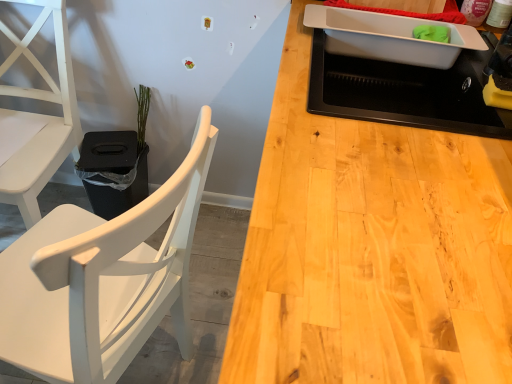
Describe the element at coordinates (142, 115) in the screenshot. I see `green matte plant at upper left` at that location.

At what (x,y) coordinates should I click in order to perform the action: click on black plastic houseplant at left. Please return your answer as a coordinate pair (x, y). The width and height of the screenshot is (512, 384). Looking at the image, I should click on (116, 165).

Locate an element on the screen. white plastic tray at upper right is located at coordinates (389, 37).

The height and width of the screenshot is (384, 512). Find the location of `white matte wood chair at left, the first chair when ordered from right to left`. white matte wood chair at left, the first chair when ordered from right to left is located at coordinates 102,279.

Considering the relative sizes of black matte sink at upper right and white plastic tray at upper right in the image provided, is black matte sink at upper right bigger than white plastic tray at upper right?

Indeed, black matte sink at upper right has a larger size compared to white plastic tray at upper right.

Is black matte sink at upper right facing towards white plastic tray at upper right?

Yes, black matte sink at upper right is turned towards white plastic tray at upper right.

How different are the orientations of black matte sink at upper right and white plastic tray at upper right in degrees?

0.000407 degrees.

You are a GUI agent. You are given a task and a screenshot of the screen. Output one action in this format:
    pyautogui.click(x=<x>, y=<y>)
    Task: Click on the appliance in front of the white plastic tray at upper right
    The height and width of the screenshot is (384, 512).
    Given the screenshot: What is the action you would take?
    pyautogui.click(x=405, y=92)

You are a GUI agent. You are given a task and a screenshot of the screen. Output one action in this format:
    pyautogui.click(x=<x>, y=<y>)
    Task: Click on the chair that is above the black plastic houseplant at left (from the image's perspective)
    
    Given the screenshot: What is the action you would take?
    pyautogui.click(x=40, y=117)

Is black plastic houseplant at left situated inside white matte chair at left, which ranks as the 2th chair in right-to-left order, or outside?

black plastic houseplant at left is located beyond the bounds of white matte chair at left, which ranks as the 2th chair in right-to-left order.

Is black plastic houseplant at left in front of or behind white matte chair at left, which ranks as the 2th chair in right-to-left order, in the image?

black plastic houseplant at left is behind white matte chair at left, which ranks as the 2th chair in right-to-left order.

Are white matte wood chair at left, marked as the 2th chair in a left-to-right arrangement, and black matte sink at upper right located far from each other?

No, there isn't a large distance between white matte wood chair at left, marked as the 2th chair in a left-to-right arrangement, and black matte sink at upper right.

Looking at this image, from a real-world perspective, does white matte wood chair at left, marked as the 2th chair in a left-to-right arrangement, stand above black matte sink at upper right?

Actually, white matte wood chair at left, marked as the 2th chair in a left-to-right arrangement, is physically below black matte sink at upper right in the real world.

Choose the correct answer: Is white matte wood chair at left, the first chair when ordered from right to left, inside black matte sink at upper right or outside it?

white matte wood chair at left, the first chair when ordered from right to left, lies outside black matte sink at upper right.

Which is correct: green matte plant at upper left is inside black matte sink at upper right, or outside of it?

green matte plant at upper left lies outside black matte sink at upper right.

Which is behind, green matte plant at upper left or black matte sink at upper right?

green matte plant at upper left is further from the camera.

Is green matte plant at upper left touching black matte sink at upper right?

green matte plant at upper left is not next to black matte sink at upper right, and they're not touching.

Can you confirm if green matte plant at upper left is positioned to the right of black matte sink at upper right?

No.

Can you tell me how much white matte chair at left, which ranks as the 2th chair in right-to-left order, and white matte wood chair at left, marked as the 2th chair in a left-to-right arrangement, differ in facing direction?

The angular difference between white matte chair at left, which ranks as the 2th chair in right-to-left order, and white matte wood chair at left, marked as the 2th chair in a left-to-right arrangement, is 106 degrees.

Is white matte chair at left, which ranks as the 2th chair in right-to-left order, facing towards white matte wood chair at left, marked as the 2th chair in a left-to-right arrangement?

No.

Is point (14, 202) closer to viewer compared to point (80, 254)?

No, it is not.

Is black plastic houseplant at left facing away from green matte plant at upper left?

No, black plastic houseplant at left's orientation is not away from green matte plant at upper left.

Is the surface of black plastic houseplant at left in direct contact with green matte plant at upper left?

No, black plastic houseplant at left is not next to green matte plant at upper left.

Which is behind, point (106, 202) or point (140, 152)?

The point (106, 202) is farther from the camera.

From the image's perspective, between black plastic houseplant at left and green matte plant at upper left, who is located below?

From the image's view, black plastic houseplant at left is below.

From a real-world perspective, which is physically below, green matte plant at upper left or white matte wood chair at left, marked as the 2th chair in a left-to-right arrangement?

From a 3D spatial view, green matte plant at upper left is below.

Does green matte plant at upper left have a lesser width compared to white matte wood chair at left, marked as the 2th chair in a left-to-right arrangement?

Indeed, green matte plant at upper left has a lesser width compared to white matte wood chair at left, marked as the 2th chair in a left-to-right arrangement.

Does point (140, 85) come in front of point (198, 206)?

Yes, it is.

Is green matte plant at upper left with white matte wood chair at left, the first chair when ordered from right to left?

No, green matte plant at upper left is not with white matte wood chair at left, the first chair when ordered from right to left.

Locate an element on the screen. This screenshot has height=384, width=512. appliance that appears below the white plastic tray at upper right (from a real-world perspective) is located at coordinates (405, 92).

Where is `houseplant below the white matte chair at left, the first chair positioned from the left (from the image's perspective)`? houseplant below the white matte chair at left, the first chair positioned from the left (from the image's perspective) is located at coordinates (116, 165).

Based on their spatial positions, is black plastic houseplant at left or white matte wood chair at left, the first chair when ordered from right to left, further from white matte chair at left, the first chair positioned from the left?

white matte wood chair at left, the first chair when ordered from right to left, is positioned further to the anchor white matte chair at left, the first chair positioned from the left.

Estimate the real-world distances between objects in this image. Which object is further from white matte wood chair at left, marked as the 2th chair in a left-to-right arrangement, black matte sink at upper right or white plastic tray at upper right?

The object further to white matte wood chair at left, marked as the 2th chair in a left-to-right arrangement, is white plastic tray at upper right.

Estimate the real-world distances between objects in this image. Which object is closer to green matte plant at upper left, black matte sink at upper right or white matte wood chair at left, marked as the 2th chair in a left-to-right arrangement?

The object closer to green matte plant at upper left is white matte wood chair at left, marked as the 2th chair in a left-to-right arrangement.

Looking at this image, looking at the image, which one is located closer to black matte sink at upper right, black plastic houseplant at left or white matte wood chair at left, the first chair when ordered from right to left?

The object closer to black matte sink at upper right is white matte wood chair at left, the first chair when ordered from right to left.

From the image, which object appears to be nearer to white matte chair at left, the first chair positioned from the left, white plastic tray at upper right or black plastic houseplant at left?

The object closer to white matte chair at left, the first chair positioned from the left, is black plastic houseplant at left.

Estimate the real-world distances between objects in this image. Which object is closer to green matte plant at upper left, black plastic houseplant at left or white matte chair at left, which ranks as the 2th chair in right-to-left order?

The object closer to green matte plant at upper left is black plastic houseplant at left.

Considering their positions, is white matte wood chair at left, marked as the 2th chair in a left-to-right arrangement, positioned further to green matte plant at upper left than black plastic houseplant at left?

Based on the image, white matte wood chair at left, marked as the 2th chair in a left-to-right arrangement, appears to be further to green matte plant at upper left.

Which object lies further to the anchor point green matte plant at upper left, black plastic houseplant at left or white matte wood chair at left, marked as the 2th chair in a left-to-right arrangement?

The object further to green matte plant at upper left is white matte wood chair at left, marked as the 2th chair in a left-to-right arrangement.

Where is `kitchen appliance between green matte plant at upper left and black matte sink at upper right from left to right`? The image size is (512, 384). kitchen appliance between green matte plant at upper left and black matte sink at upper right from left to right is located at coordinates (389, 37).

I want to click on chair between white matte chair at left, which ranks as the 2th chair in right-to-left order, and black matte sink at upper right, in the horizontal direction, so click(102, 279).

Locate an element on the screen. houseplant between white matte chair at left, the first chair positioned from the left, and black matte sink at upper right, in the horizontal direction is located at coordinates (116, 165).

Where is `appliance positioned between white matte wood chair at left, marked as the 2th chair in a left-to-right arrangement, and green matte plant at upper left from near to far`? This screenshot has height=384, width=512. appliance positioned between white matte wood chair at left, marked as the 2th chair in a left-to-right arrangement, and green matte plant at upper left from near to far is located at coordinates (405, 92).